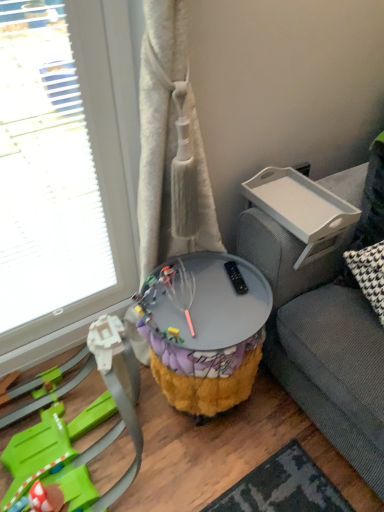
Question: Considering the positions of white plastic tray at upper right, arranged as the first table when viewed from the top, and plush yellow and purple toy at lower left in the image, is white plastic tray at upper right, arranged as the first table when viewed from the top, wider or thinner than plush yellow and purple toy at lower left?

Choices:
 (A) wide
 (B) thin

Answer: (B)

Question: From the image's perspective, relative to plush yellow and purple toy at lower left, is white plastic tray at upper right, arranged as the first table when viewed from the top, above or below?

Choices:
 (A) above
 (B) below

Answer: (A)

Question: Estimate the real-world distances between objects in this image. Which object is closer to the fuzzy fabric side table at center, acting as the 2th table starting from the top?

Choices:
 (A) transparent glass door at left
 (B) plush yellow and purple toy at lower left
 (C) white plastic tray at upper right, arranged as the first table when viewed from the top

Answer: (B)

Question: Which object is positioned closest to the transparent glass door at left?

Choices:
 (A) plush yellow and purple toy at lower left
 (B) white plastic tray at upper right, arranged as the first table when viewed from the top
 (C) fuzzy fabric side table at center, acting as the 2th table starting from the top

Answer: (A)